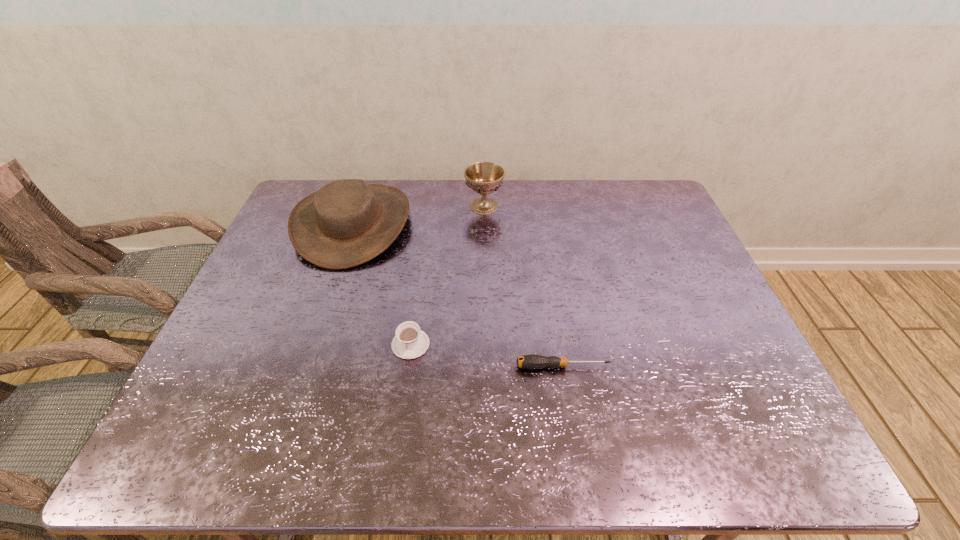
This screenshot has height=540, width=960. What are the coordinates of `free space between the teacup and the shortest object` in the screenshot? It's located at (487, 355).

At what (x,y) coordinates should I click in order to perform the action: click on empty space between the leftmost object and the rightmost object. Please return your answer as a coordinate pair (x, y). Looking at the image, I should click on (458, 295).

This screenshot has width=960, height=540. Find the location of `vacant area that lies between the second object from right to left and the cowboy hat`. vacant area that lies between the second object from right to left and the cowboy hat is located at coordinates (419, 215).

Where is `free spot between the cowboy hat and the third farthest object`? The image size is (960, 540). free spot between the cowboy hat and the third farthest object is located at coordinates (382, 284).

The width and height of the screenshot is (960, 540). I want to click on vacant area between the leftmost object and the screwdriver, so click(458, 295).

Identify the location of vacant region between the screwdriver and the third farthest object. (487, 355).

Identify the location of free area in between the shortest object and the third object from left to right. (523, 286).

Find the location of a particular element. The height and width of the screenshot is (540, 960). vacant region between the nearest object and the third farthest object is located at coordinates pyautogui.click(x=487, y=355).

I want to click on free point between the chalice and the shortest object, so click(523, 286).

Locate which object ranks third in proximity to the third object from left to right. Please provide its 2D coordinates. Your answer should be formatted as a tuple, i.e. [(x, y)], where the tuple contains the x and y coordinates of a point satisfying the conditions above.

[(532, 361)]